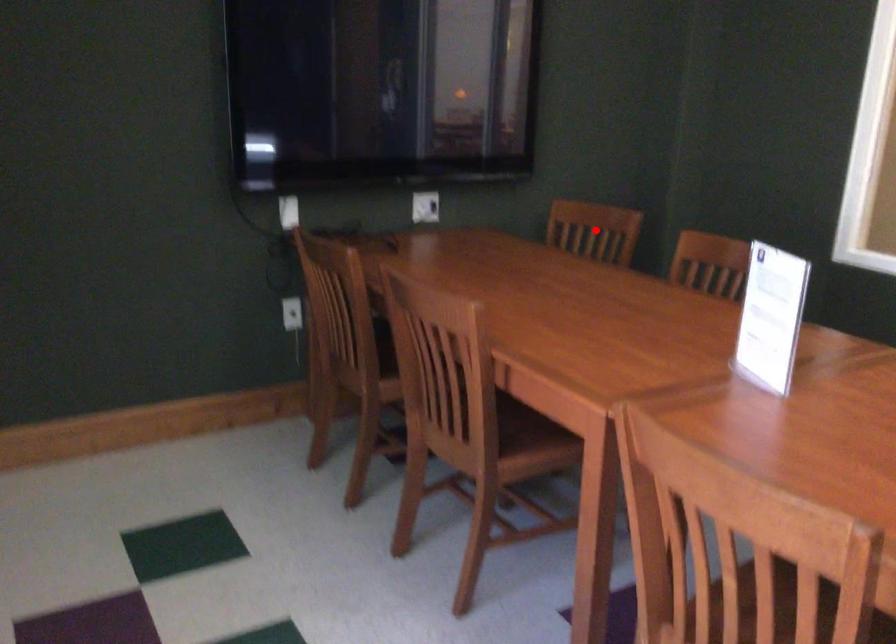
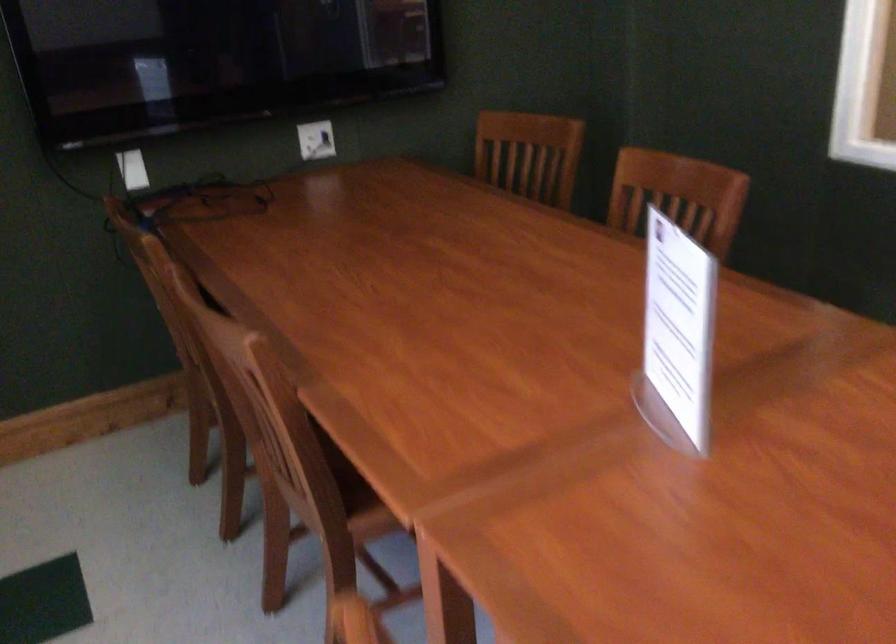
The point at the highlighted location is marked in the first image. Where is the corresponding point in the second image?

(529, 154)